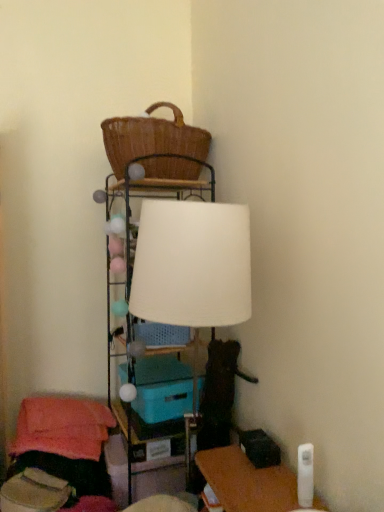
I want to click on teal plastic storage box at center, so click(x=162, y=388).

In order to face matte plastic table at center, should I rotate leftwards or rightwards?

Rotate your view left by about 6.342°.

Where is `white fabric lampshade at upper center`? Image resolution: width=384 pixels, height=512 pixels. white fabric lampshade at upper center is located at coordinates (137, 180).

Locate an element on the screen. The image size is (384, 512). white matte lampshade at center is located at coordinates (192, 264).

Which of these two, matte plastic table at center or white matte lampshade at center, is wider?

matte plastic table at center.

From a real-world perspective, does matte plastic table at center sit lower than white matte lampshade at center?

Indeed, from a real-world perspective, matte plastic table at center is positioned beneath white matte lampshade at center.

From the image's perspective, would you say matte plastic table at center is shown under white matte lampshade at center?

Yes, from the image's perspective, matte plastic table at center is below white matte lampshade at center.

Is matte plastic table at center completely or partially inside white matte lampshade at center?

No, matte plastic table at center is not surrounded by white matte lampshade at center.

How far apart are white matte lampshade at center and matte plastic table at center?

white matte lampshade at center is 35.00 inches away from matte plastic table at center.

From the picture: In terms of width, does white matte lampshade at center look wider or thinner when compared to matte plastic table at center?

Clearly, white matte lampshade at center has less width compared to matte plastic table at center.

Does white matte lampshade at center touch matte plastic table at center?

No.

Find the location of a particular element. This screenshot has height=512, width=384. storage box on the right of the woven brown basket at upper center is located at coordinates click(162, 388).

Is teal plastic storage box at center to the right of woven brown basket at upper center from the viewer's perspective?

Indeed, teal plastic storage box at center is positioned on the right side of woven brown basket at upper center.

From the image's perspective, is teal plastic storage box at center below woven brown basket at upper center?

Yes, from the image's perspective, teal plastic storage box at center is below woven brown basket at upper center.

Can you confirm if matte plastic table at center is smaller than white fabric lampshade at upper center?

Yes, matte plastic table at center is smaller than white fabric lampshade at upper center.

Is matte plastic table at center oriented away from white fabric lampshade at upper center?

Yes, white fabric lampshade at upper center is at the back of matte plastic table at center.

Is matte plastic table at center directly adjacent to white fabric lampshade at upper center?

No, matte plastic table at center is not making contact with white fabric lampshade at upper center.

Looking at this image, from the image's perspective, which one is positioned higher, matte plastic table at center or teal plastic storage box at center?

teal plastic storage box at center.

Would you say matte plastic table at center is outside teal plastic storage box at center?

Absolutely, matte plastic table at center is external to teal plastic storage box at center.

Looking at their sizes, would you say matte plastic table at center is wider or thinner than teal plastic storage box at center?

Considering their sizes, matte plastic table at center looks broader than teal plastic storage box at center.

Is matte plastic table at center next to teal plastic storage box at center?

No, matte plastic table at center is not making contact with teal plastic storage box at center.

Where is `basket behind the white matte lampshade at center`? This screenshot has height=512, width=384. basket behind the white matte lampshade at center is located at coordinates (156, 144).

Does woven brown basket at upper center have a greater height compared to white matte lampshade at center?

Incorrect, the height of woven brown basket at upper center is not larger of that of white matte lampshade at center.

Is woven brown basket at upper center situated inside white matte lampshade at center or outside?

woven brown basket at upper center is spatially situated outside white matte lampshade at center.

Could you tell me if woven brown basket at upper center is turned towards white matte lampshade at center?

No, woven brown basket at upper center is not aimed at white matte lampshade at center.

Considering the positions of point (183, 474) and point (155, 106), is point (183, 474) closer or farther from the camera than point (155, 106)?

Point (183, 474) appears to be closer to the viewer than point (155, 106).

Relative to woven brown basket at upper center, is matte plastic table at center in front or behind?

In the image, matte plastic table at center appears behind woven brown basket at upper center.

Is matte plastic table at center wider or thinner than woven brown basket at upper center?

In the image, matte plastic table at center appears to be more narrow than woven brown basket at upper center.

Looking at this image, from the image's perspective, which object appears higher, matte plastic table at center or woven brown basket at upper center?

woven brown basket at upper center.

The height and width of the screenshot is (512, 384). Identify the location of lamp above the matte plastic table at center (from a real-world perspective). (x=192, y=264).

This screenshot has height=512, width=384. I want to click on table that appears below the white matte lampshade at center (from a real-world perspective), so click(x=158, y=465).

When comparing their distances from woven brown basket at upper center, does matte plastic table at center or white matte lampshade at center seem closer?

white matte lampshade at center.

Estimate the real-world distances between objects in this image. Which object is closer to teal plastic storage box at center, white matte lampshade at center or white fabric lampshade at upper center?

The object closer to teal plastic storage box at center is white fabric lampshade at upper center.

Estimate the real-world distances between objects in this image. Which object is further from matte plastic table at center, teal plastic storage box at center or white fabric lampshade at upper center?

teal plastic storage box at center is further to matte plastic table at center.

Based on their spatial positions, is matte plastic table at center or teal plastic storage box at center closer to woven brown basket at upper center?

teal plastic storage box at center lies closer to woven brown basket at upper center than the other object.

From the image, which object appears to be farther from woven brown basket at upper center, white matte lampshade at center or white fabric lampshade at upper center?

The object further to woven brown basket at upper center is white fabric lampshade at upper center.

When comparing their distances from white fabric lampshade at upper center, does white matte lampshade at center or matte plastic table at center seem further?

white matte lampshade at center lies further to white fabric lampshade at upper center than the other object.

From the image, which object appears to be nearer to woven brown basket at upper center, white matte lampshade at center or teal plastic storage box at center?

white matte lampshade at center is positioned closer to the anchor woven brown basket at upper center.

When comparing their distances from white matte lampshade at center, does woven brown basket at upper center or matte plastic table at center seem further?

The object further to white matte lampshade at center is matte plastic table at center.

Where is `shelf between white matte lampshade at center and matte plastic table at center along the z-axis`? shelf between white matte lampshade at center and matte plastic table at center along the z-axis is located at coordinates (137, 180).

Locate an element on the screen. This screenshot has height=512, width=384. lamp between woven brown basket at upper center and matte plastic table at center in the vertical direction is located at coordinates (192, 264).

Find the location of a particular element. This screenshot has height=512, width=384. shelf that lies between woven brown basket at upper center and teal plastic storage box at center from top to bottom is located at coordinates (137, 180).

Identify the location of storage box that lies between woven brown basket at upper center and matte plastic table at center from top to bottom. The height and width of the screenshot is (512, 384). (162, 388).